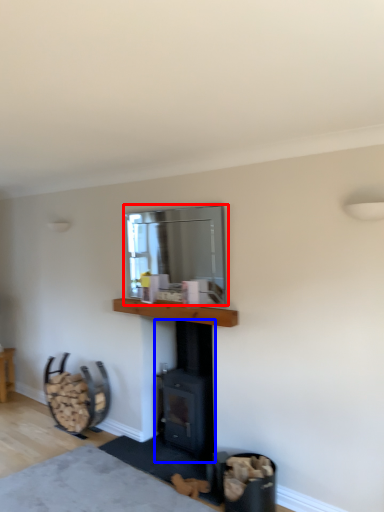
Question: Which object appears farthest to the camera in this image, window screen (highlighted by a red box) or wood burning stove (highlighted by a blue box)?

Choices:
 (A) window screen
 (B) wood burning stove

Answer: (B)